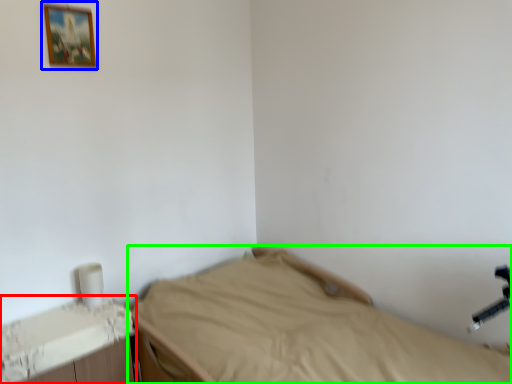
Question: Estimate the real-world distances between objects in this image. Which object is closer to changing table (highlighted by a red box), picture frame (highlighted by a blue box) or bed (highlighted by a green box)?

Choices:
 (A) picture frame
 (B) bed

Answer: (B)